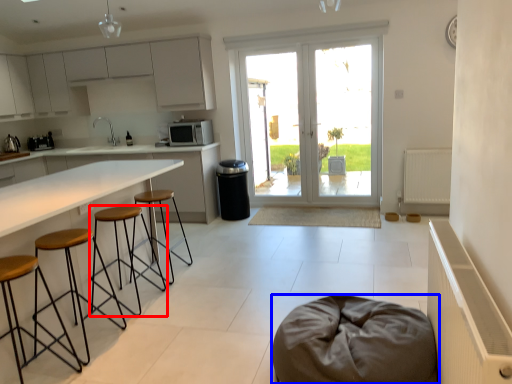
Question: Among these objects, which one is nearest to the camera, stool (highlighted by a red box) or furniture (highlighted by a blue box)?

Choices:
 (A) stool
 (B) furniture

Answer: (B)